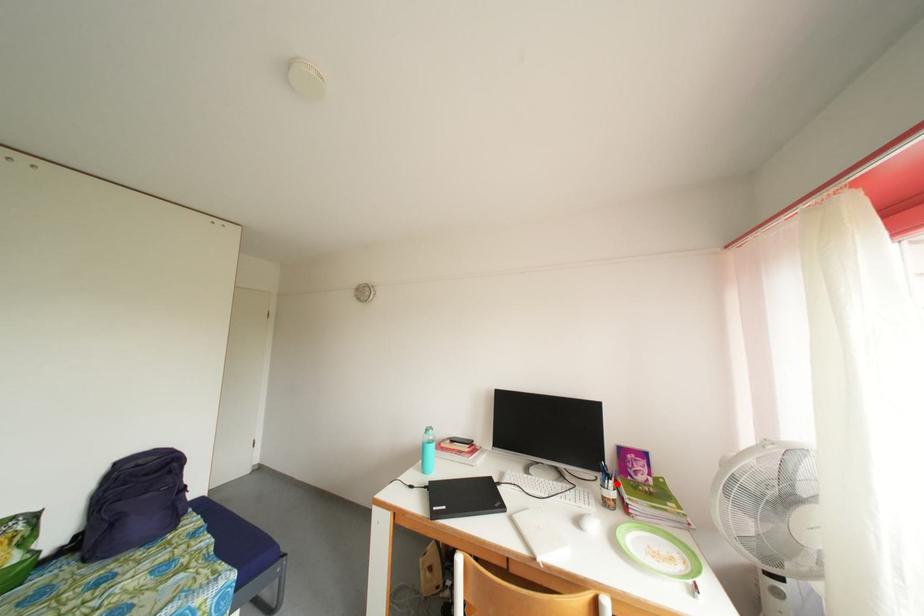
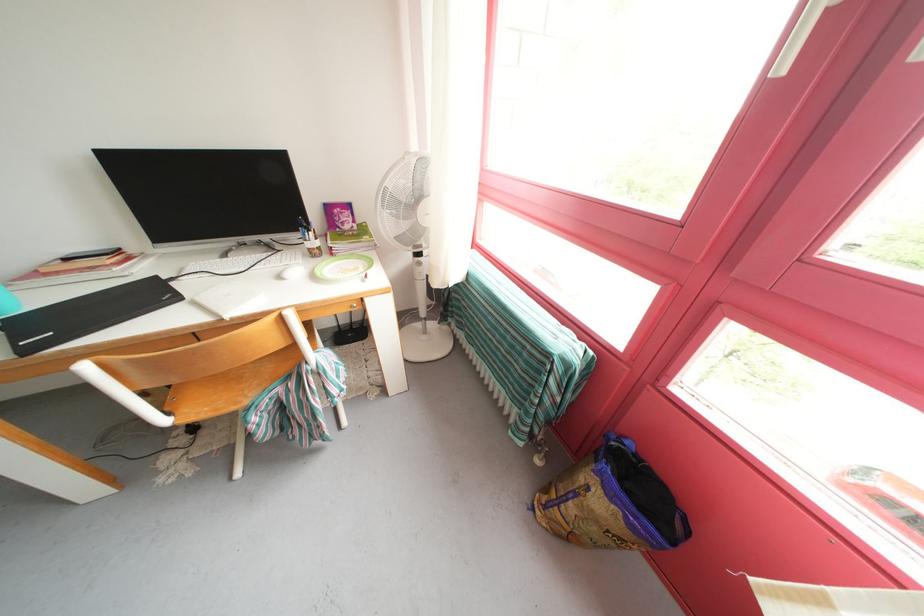
Locate, in the second image, the point that corresponds to the highlighted location in the first image.

(315, 236)